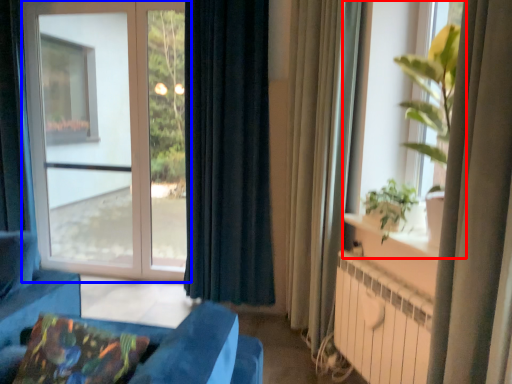
Question: Which of the following is the closest to the observer, window (highlighted by a red box) or window (highlighted by a blue box)?

Choices:
 (A) window
 (B) window

Answer: (A)